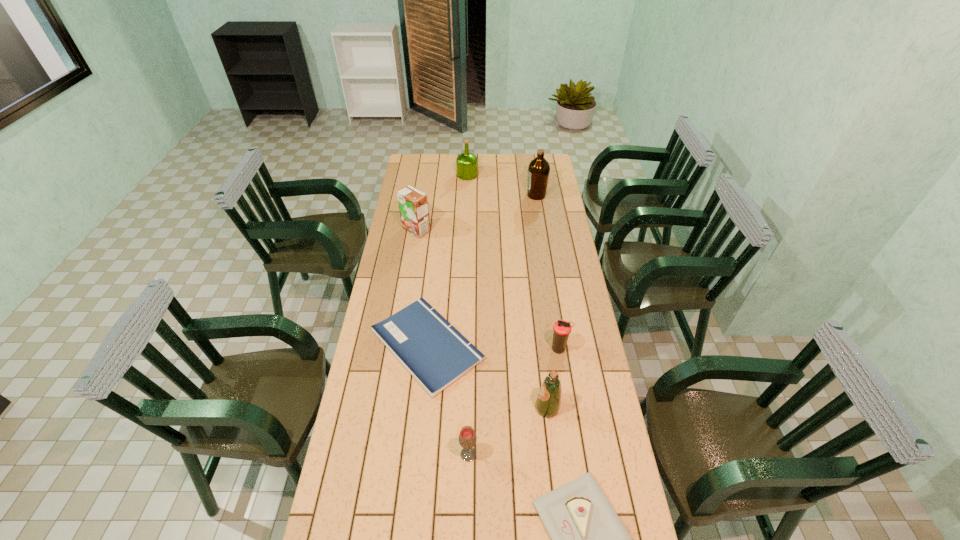
Identify the location of object at the far edge. (466, 163).

Locate an element on the screen. carton located at the left edge is located at coordinates (413, 204).

Identify the location of paperback book that is at the left edge. pyautogui.click(x=435, y=353).

At what (x,y) coordinates should I click in order to perform the action: click on olive oil present at the right edge. Please return your answer as a coordinate pair (x, y). This screenshot has width=960, height=540. Looking at the image, I should click on (539, 169).

Identify the location of thermos bottle that is at the right edge. The height and width of the screenshot is (540, 960). (562, 328).

Find the location of a particular element. This screenshot has height=540, width=960. vacant region at the far edge of the desktop is located at coordinates (500, 170).

This screenshot has height=540, width=960. In order to click on free space at the left edge of the desktop in this screenshot , I will do `click(396, 231)`.

Locate an element on the screen. This screenshot has width=960, height=540. vacant space at the right edge of the desktop is located at coordinates (554, 177).

Where is `free location at the far right corner`? Image resolution: width=960 pixels, height=540 pixels. free location at the far right corner is located at coordinates (537, 156).

This screenshot has width=960, height=540. Identify the location of free space that is in between the thermos bottle and the second farthest olive oil. (547, 272).